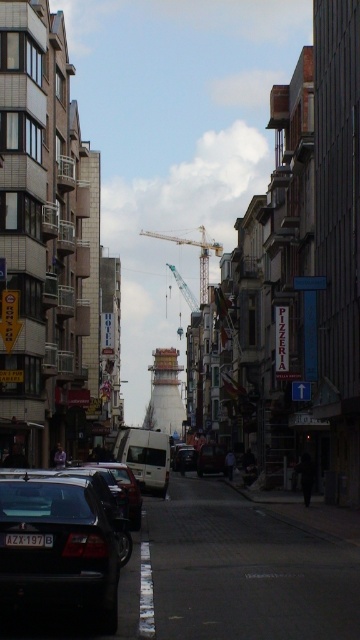
You are a delivery driver who needs to park your shiny silver van at center in this narrow street. The city requires vehicles to park only in designated parking zones marked with white lines. According to the image, where would you position your van to comply with parking regulations?

The city requires vehicles to park only in designated parking zones marked with white lines, but the image does not show any such markings. Therefore, it is unclear where to park the shiny silver van at center appropriately.

In the scene shown: You are standing on the narrow urban street depicted in the scene. There are two points marked on the ground ahead of you. The first point is at coordinates (209, 244) and the second is at (189, 465). Which point is closer to you as you face the street?

Point (209, 244) is closer to you because it is further to the viewer than point (189, 465).